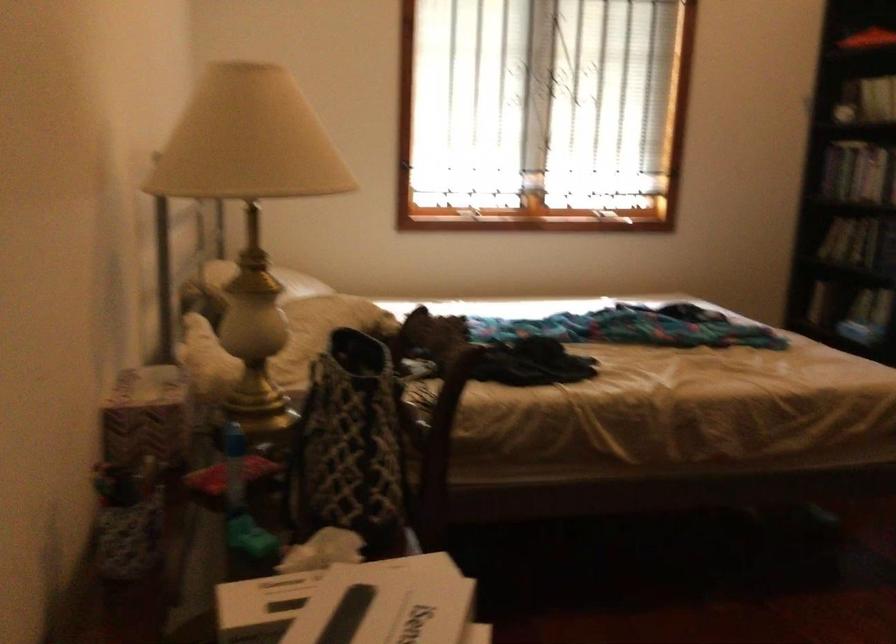
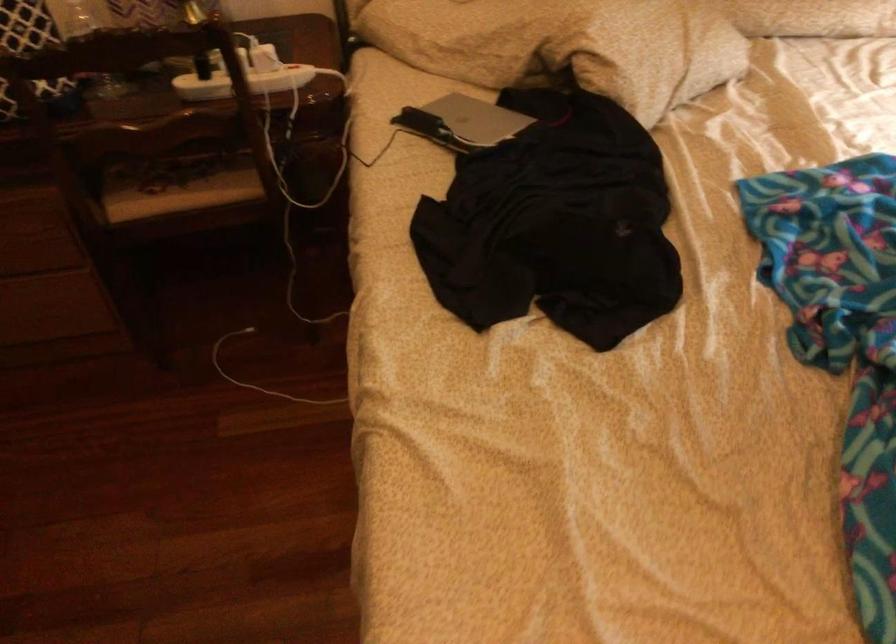
Locate, in the second image, the point that corresponds to the point at 393,375 in the first image.

(243, 82)